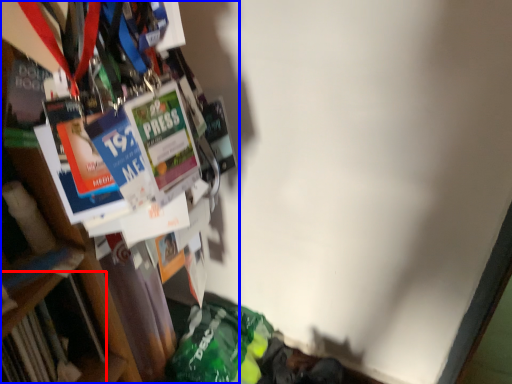
Question: Which point is further to the camera, book (highlighted by a red box) or bookcase (highlighted by a blue box)?

Choices:
 (A) book
 (B) bookcase

Answer: (A)